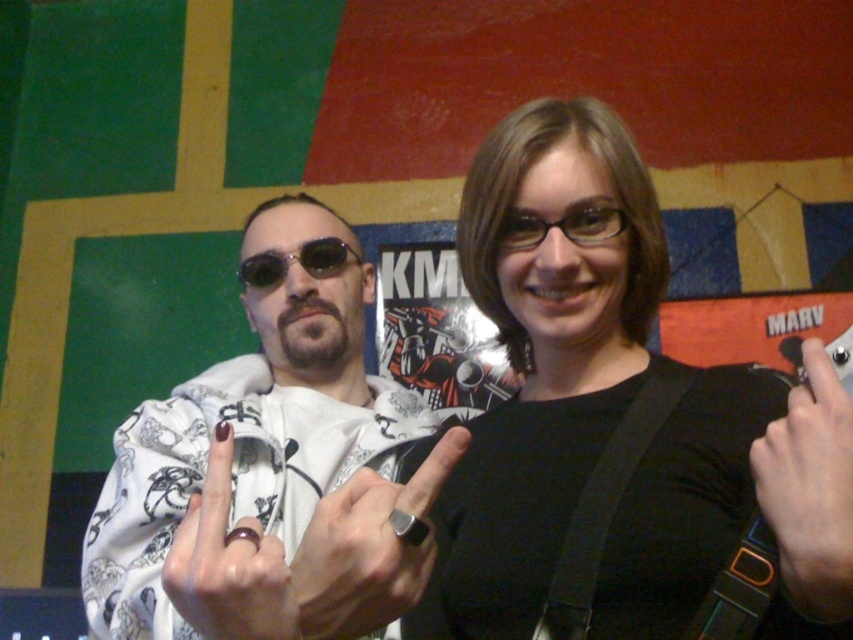
Which of these two, white printed hoodie at center or silver metallic ring at center, stands shorter?

silver metallic ring at center is shorter.

Which is behind, point (149, 570) or point (305, 586)?

Point (149, 570)

The height and width of the screenshot is (640, 853). I want to click on white printed hoodie at center, so pyautogui.click(x=273, y=456).

Can you confirm if black leather hand at center is positioned below sunglasses at center?

Yes.

Which is more to the left, black leather hand at center or sunglasses at center?

sunglasses at center is more to the left.

Which is behind, point (830, 417) or point (315, 243)?

The point (315, 243) is more distant.

I want to click on black leather hand at center, so click(810, 490).

Where is `white printed hoodie at center`? This screenshot has width=853, height=640. white printed hoodie at center is located at coordinates (273, 456).

Which is below, white printed hoodie at center or black leather hand at center?

Positioned lower is white printed hoodie at center.

You are a GUI agent. You are given a task and a screenshot of the screen. Output one action in this format:
    pyautogui.click(x=<x>, y=<y>)
    Task: Click on the white printed hoodie at center
    This screenshot has height=640, width=853.
    Given the screenshot: What is the action you would take?
    pyautogui.click(x=273, y=456)

Identify the location of white printed hoodie at center. The width and height of the screenshot is (853, 640). (273, 456).